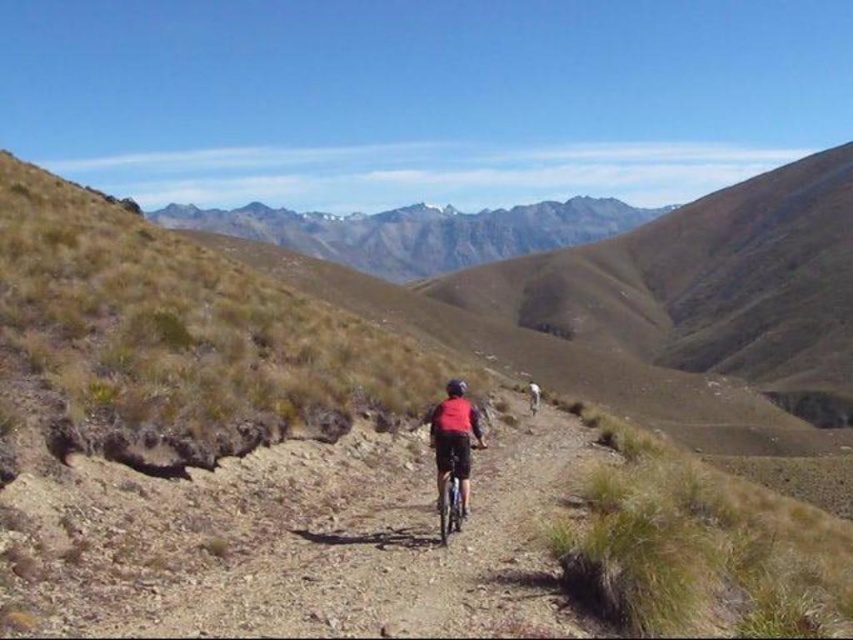
Based on the scene description, where is the rugged granite mountains at center located in terms of coordinates?

The rugged granite mountains at center are located at coordinates point (418, 230).

You are a mountain biker planning your route. You see the point marked at coordinates (418, 230). What does this point indicate in the scene?

The point at coordinates (418, 230) indicates the rugged granite mountains at center, which are part of the mountain biking trail backdrop.

You are a hiker planning to take a photo of the rugged granite mountains at center and the red matte jacket at center. Which object should you focus on first to ensure both are in frame?

The rugged granite mountains at center is positioned over the red matte jacket at center, so you should focus on the rugged granite mountains at center first to ensure both are in frame.